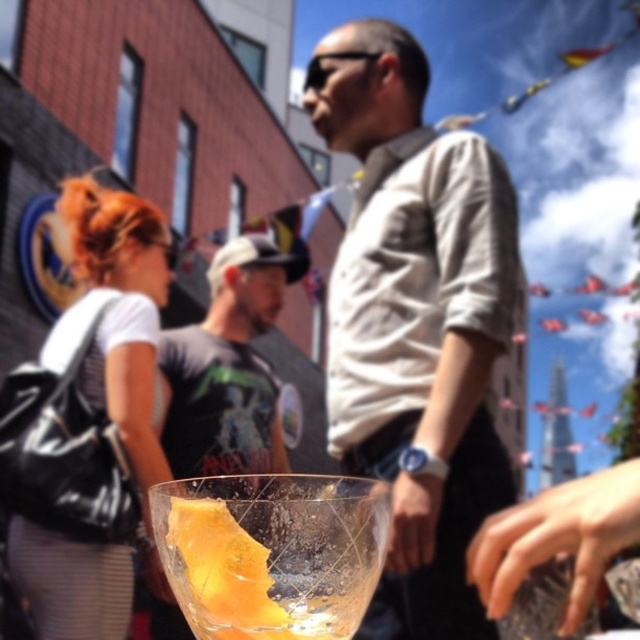
Question: Can you confirm if white matte shirt at center is positioned to the left of matte black backpack at left?

Choices:
 (A) no
 (B) yes

Answer: (A)

Question: Is white matte shirt at center to the left of matte black t-shirt at center from the viewer's perspective?

Choices:
 (A) yes
 (B) no

Answer: (B)

Question: Can you confirm if white matte shirt at center is positioned to the left of translucent glass at center?

Choices:
 (A) no
 (B) yes

Answer: (A)

Question: Among these objects, which one is nearest to the camera?

Choices:
 (A) white matte shirt at center
 (B) translucent glass at center
 (C) matte black backpack at left

Answer: (B)

Question: Which point is closer to the camera taking this photo?

Choices:
 (A) (330, 346)
 (B) (113, 406)
 (C) (220, 413)

Answer: (B)

Question: Which point is farther from the camera taking this photo?

Choices:
 (A) (378, 189)
 (B) (116, 492)
 (C) (211, 460)
 (D) (280, 564)

Answer: (A)